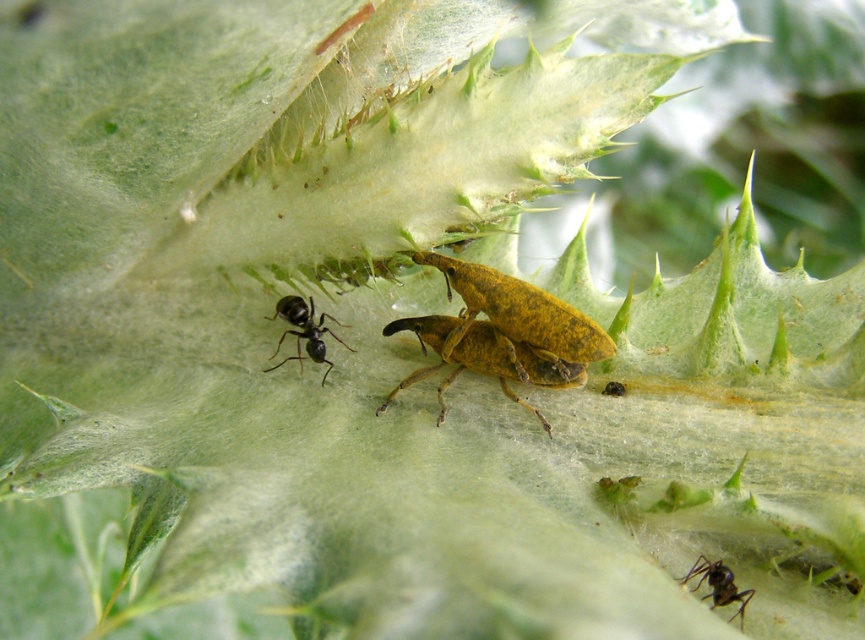
Question: Among these points, which one is nearest to the camera?

Choices:
 (A) (503, 392)
 (B) (295, 312)
 (C) (712, 598)

Answer: (C)

Question: Where is yellowish-brown textured beetle at center located in relation to black matte ant at center in the image?

Choices:
 (A) right
 (B) left

Answer: (A)

Question: Can you confirm if black matte ant at center is smaller than black glossy ant at lower right?

Choices:
 (A) yes
 (B) no

Answer: (B)

Question: Which point is closer to the camera?

Choices:
 (A) black matte ant at center
 (B) black glossy ant at lower right

Answer: (B)

Question: Which point appears closest to the camera in this image?

Choices:
 (A) (318, 333)
 (B) (463, 312)
 (C) (750, 593)

Answer: (C)

Question: Does black matte ant at center have a smaller size compared to black glossy ant at lower right?

Choices:
 (A) yes
 (B) no

Answer: (B)